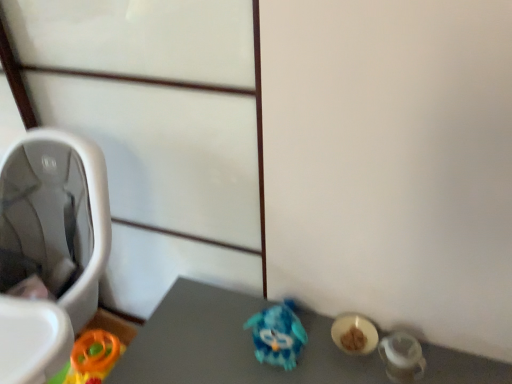
Question: Is blue plastic toy at center taller or shorter than white plastic baby carriage at left?

Choices:
 (A) short
 (B) tall

Answer: (A)

Question: In the image, is blue plastic toy at center on the left side or the right side of white plastic baby carriage at left?

Choices:
 (A) left
 (B) right

Answer: (B)

Question: Considering the real-world distances, which object is farthest from the blue shiny toy at center?

Choices:
 (A) blue plastic toy at center
 (B) white plastic baby carriage at left

Answer: (B)

Question: Which object is positioned farthest from the white plastic baby carriage at left?

Choices:
 (A) blue shiny toy at center
 (B) blue plastic toy at center

Answer: (B)